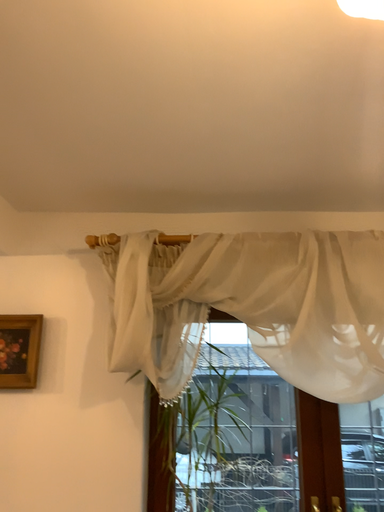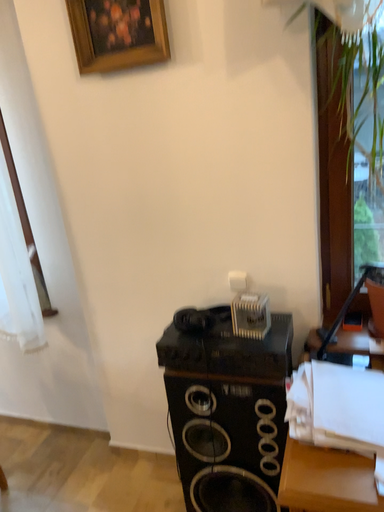
Question: How did the camera likely rotate when shooting the video?

Choices:
 (A) rotated downward
 (B) rotated upward

Answer: (A)